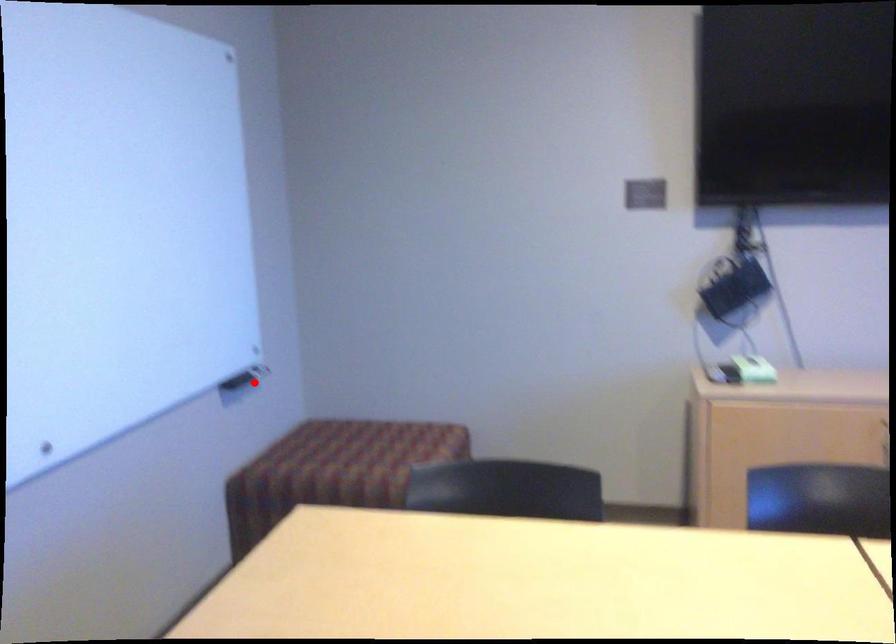
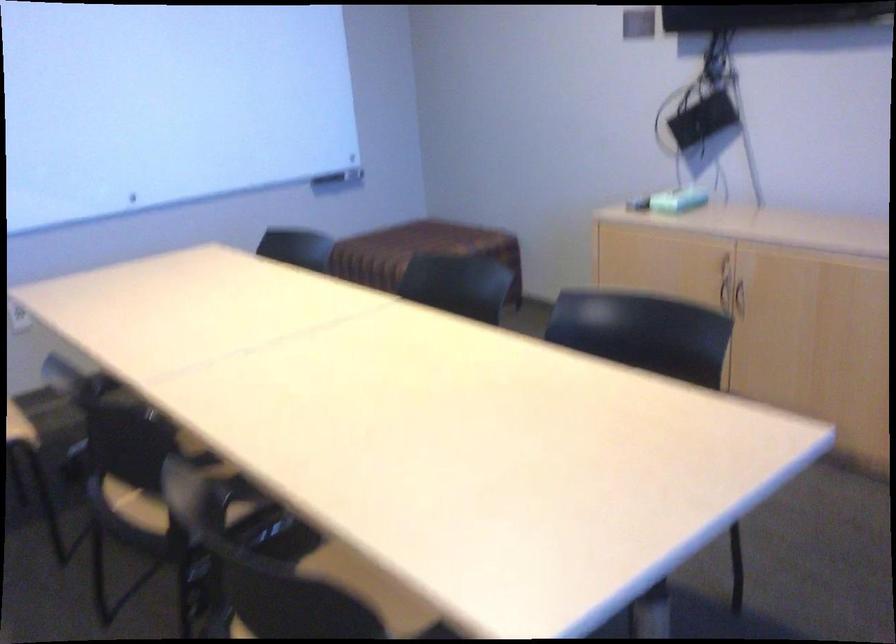
Where in the second image is the point corresponding to the highlighted location from the first image?

(339, 178)